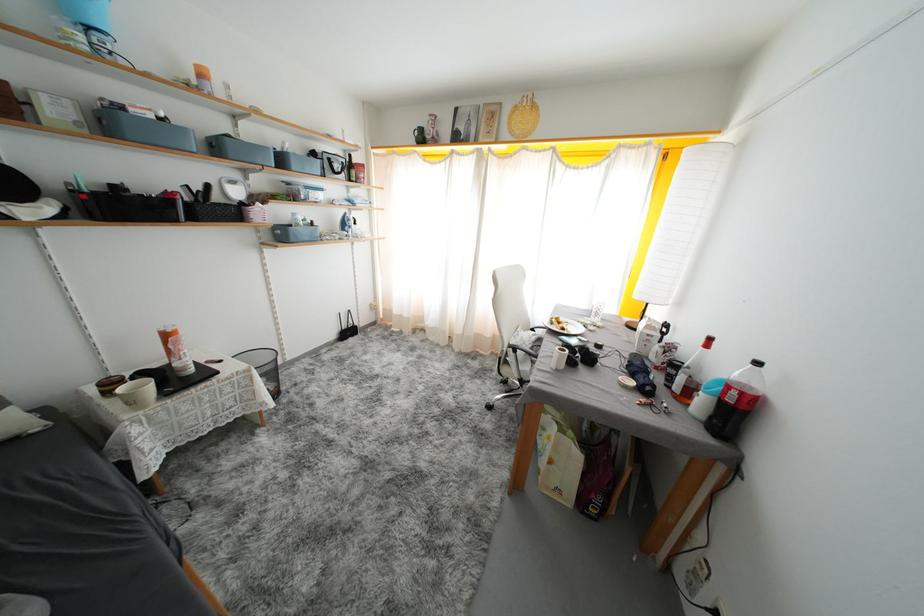
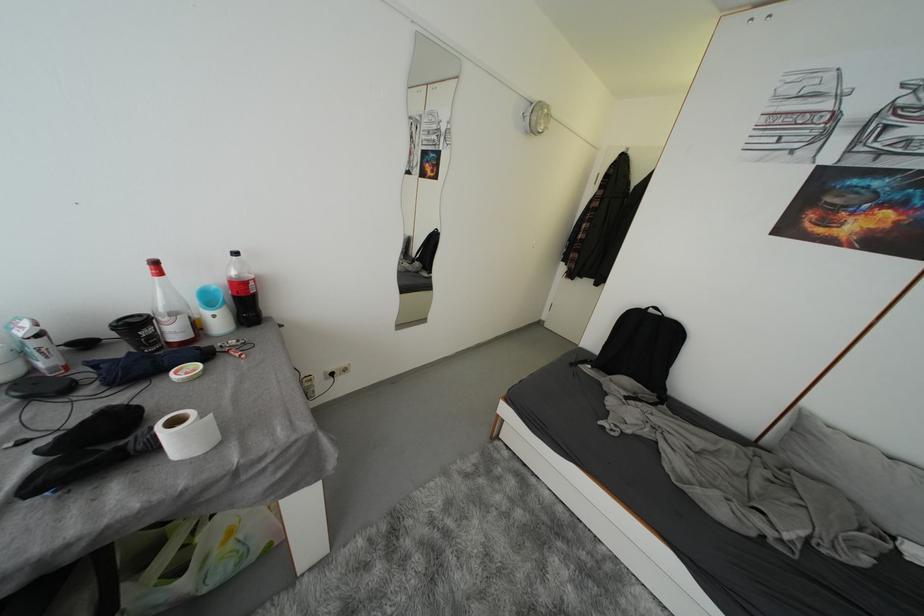
Locate, in the second image, the point that corresponds to [716,342] in the first image.

(162, 267)